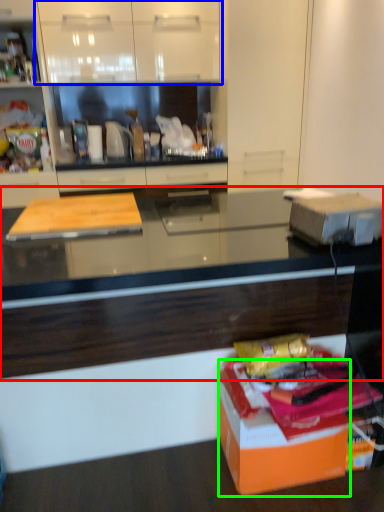
Question: Estimate the real-world distances between objects in this image. Which object is farther from countertop (highlighted by a red box), cabinetry (highlighted by a blue box) or cardboard box (highlighted by a green box)?

Choices:
 (A) cabinetry
 (B) cardboard box

Answer: (A)